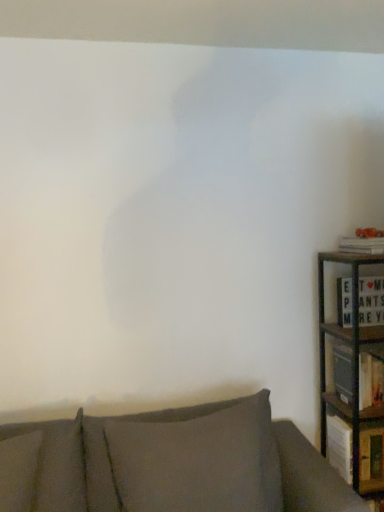
Question: Is dark gray fabric pillow at lower center behind orange textured book at right, which is the 1th book from top to bottom?

Choices:
 (A) no
 (B) yes

Answer: (A)

Question: Is dark gray fabric pillow at lower center bigger than orange textured book at right, the third book from the bottom?

Choices:
 (A) yes
 (B) no

Answer: (A)

Question: Considering the relative sizes of dark gray fabric pillow at lower center and orange textured book at right, the third book from the bottom, in the image provided, is dark gray fabric pillow at lower center taller than orange textured book at right, the third book from the bottom,?

Choices:
 (A) no
 (B) yes

Answer: (B)

Question: Is dark gray fabric pillow at lower center positioned far away from orange textured book at right, the third book from the bottom?

Choices:
 (A) yes
 (B) no

Answer: (A)

Question: Can you confirm if dark gray fabric pillow at lower center is positioned to the left of orange textured book at right, which is the 1th book from top to bottom?

Choices:
 (A) no
 (B) yes

Answer: (B)

Question: From the image's perspective, is dark gray fabric pillow at lower center above orange textured book at right, which is the 1th book from top to bottom?

Choices:
 (A) no
 (B) yes

Answer: (A)

Question: Is orange textured book at right, the third book from the bottom, positioned before wooden book at right, placed as the 1th book when sorted from bottom to top?

Choices:
 (A) no
 (B) yes

Answer: (B)

Question: Is orange textured book at right, which is the 1th book from top to bottom, aimed at wooden book at right, positioned as the 3th book in top-to-bottom order?

Choices:
 (A) no
 (B) yes

Answer: (A)

Question: Considering the relative sizes of orange textured book at right, which is the 1th book from top to bottom, and wooden book at right, placed as the 1th book when sorted from bottom to top, in the image provided, is orange textured book at right, which is the 1th book from top to bottom, smaller than wooden book at right, placed as the 1th book when sorted from bottom to top,?

Choices:
 (A) no
 (B) yes

Answer: (B)

Question: From the image's perspective, is orange textured book at right, the third book from the bottom, beneath wooden book at right, placed as the 1th book when sorted from bottom to top?

Choices:
 (A) no
 (B) yes

Answer: (A)

Question: Can you confirm if orange textured book at right, the third book from the bottom, is wider than wooden book at right, placed as the 1th book when sorted from bottom to top?

Choices:
 (A) no
 (B) yes

Answer: (B)

Question: Is orange textured book at right, the third book from the bottom, surrounding wooden book at right, positioned as the 3th book in top-to-bottom order?

Choices:
 (A) yes
 (B) no

Answer: (B)

Question: Is dark gray fabric pillow at lower center in contact with white matte letter board at right, placed as the second book when sorted from bottom to top?

Choices:
 (A) yes
 (B) no

Answer: (B)